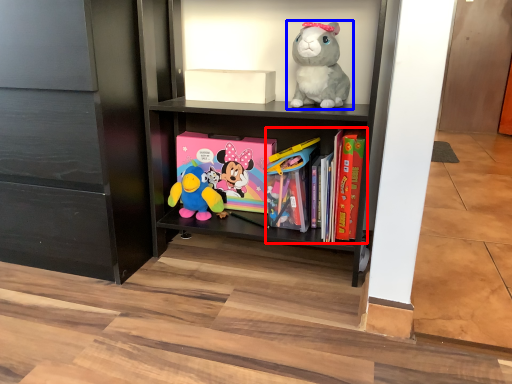
Question: Among these objects, which one is nearest to the camera, book (highlighted by a red box) or toy (highlighted by a blue box)?

Choices:
 (A) book
 (B) toy

Answer: (B)